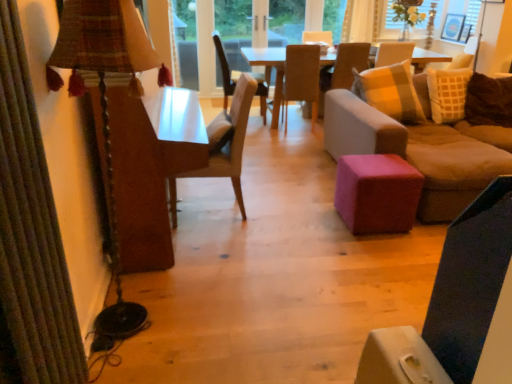
Locate an element on the screen. This screenshot has height=384, width=512. vacant space in textured fabric lampshade at left (from a real-world perspective) is located at coordinates (156, 303).